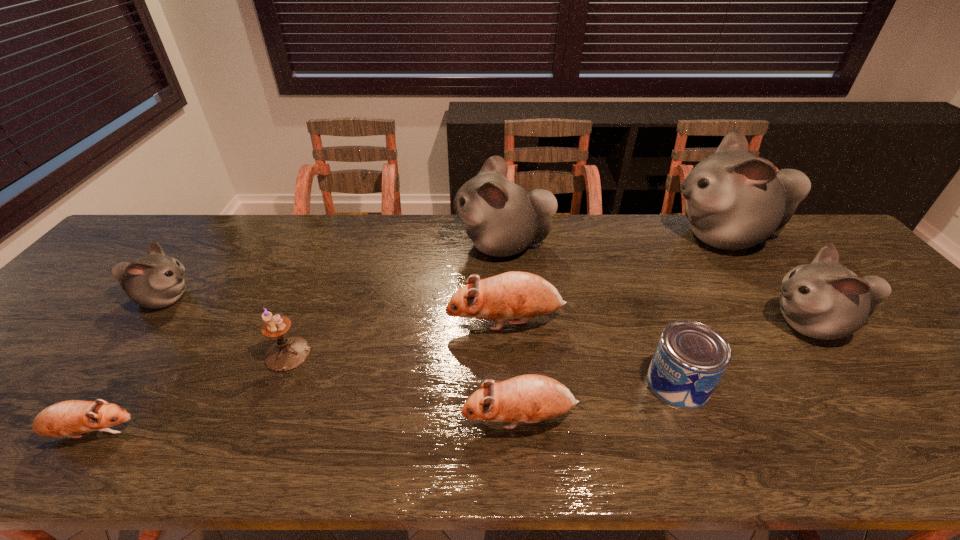
The width and height of the screenshot is (960, 540). In order to click on free location located 0.390m on the face of the second white hamster from left to right in this screenshot , I will do `click(329, 245)`.

Find the location of a particular element. The height and width of the screenshot is (540, 960). vacant space positioned 0.300m on the face of the third tallest object is located at coordinates (645, 324).

Where is `vacant space located on the face of the third tallest object`? Image resolution: width=960 pixels, height=540 pixels. vacant space located on the face of the third tallest object is located at coordinates (673, 324).

Where is `free region located 0.130m on the face of the third tallest object`? free region located 0.130m on the face of the third tallest object is located at coordinates click(x=712, y=324).

Locate an element on the screen. This screenshot has width=960, height=540. free space located on the face of the leftmost white hamster is located at coordinates (250, 299).

Where is `free space located 0.160m on the back of the seventh object from right to left`? The width and height of the screenshot is (960, 540). free space located 0.160m on the back of the seventh object from right to left is located at coordinates (314, 293).

This screenshot has width=960, height=540. I want to click on vacant space situated at the face of the biggest brown hamster, so (309, 322).

The width and height of the screenshot is (960, 540). Identify the location of free space located at the face of the biggest brown hamster. (337, 322).

Image resolution: width=960 pixels, height=540 pixels. Find the location of `free space located 0.200m at the face of the biggest brown hamster`. free space located 0.200m at the face of the biggest brown hamster is located at coordinates (369, 322).

Locate an element on the screen. free spot located on the front label of the third object from right to left is located at coordinates (486, 383).